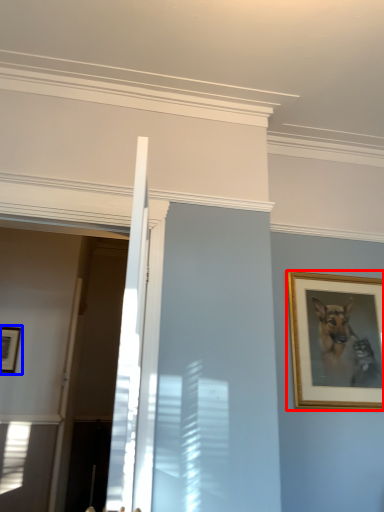
Question: Which of the following is the farthest to the observer, picture frame (highlighted by a red box) or picture frame (highlighted by a blue box)?

Choices:
 (A) picture frame
 (B) picture frame

Answer: (B)